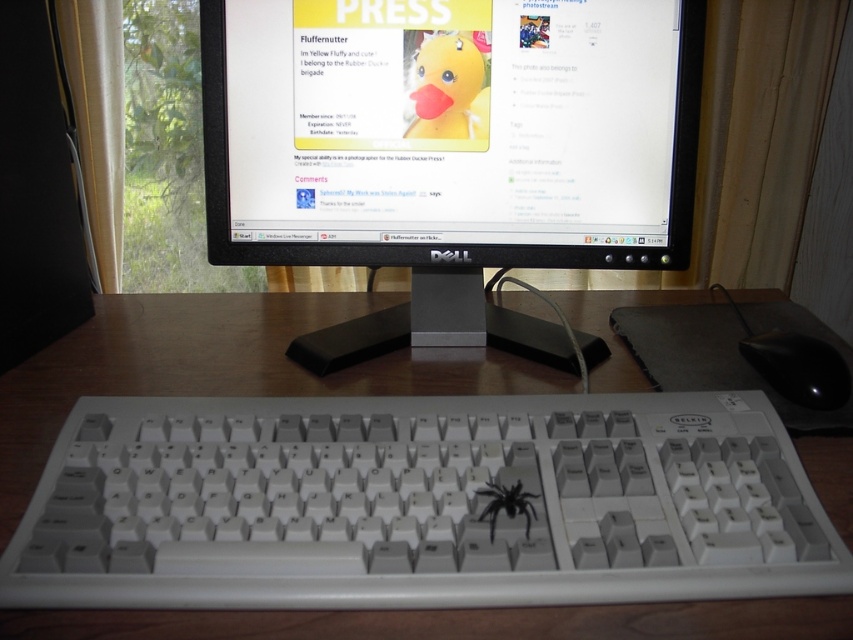
Find the location of a particular element. yellow matte rubber duck at center is located at coordinates (450, 131).

Looking at this image, can you confirm if yellow matte rubber duck at center is thinner than wooden at center?

Yes.

What are the coordinates of `yellow matte rubber duck at center` in the screenshot? It's located at (450, 131).

Is wooden at center positioned before black glossy mouse at lower right?

Yes, wooden at center is in front of black glossy mouse at lower right.

Which of these two, wooden at center or black glossy mouse at lower right, stands shorter?

black glossy mouse at lower right is shorter.

Is point (254, 381) positioned after point (741, 349)?

That is False.

Locate an element on the screen. This screenshot has width=853, height=640. wooden at center is located at coordinates (218, 365).

Is yellow matte rubber duck at center shorter than black matte spider at center?

In fact, yellow matte rubber duck at center may be taller than black matte spider at center.

From the picture: Who is higher up, yellow matte rubber duck at center or black matte spider at center?

yellow matte rubber duck at center is above.

Which is behind, point (477, 244) or point (515, 483)?

The point (477, 244) is more distant.

At what (x,y) coordinates should I click in order to perform the action: click on yellow matte rubber duck at center. Please return your answer as a coordinate pair (x, y). The image size is (853, 640). Looking at the image, I should click on tap(450, 131).